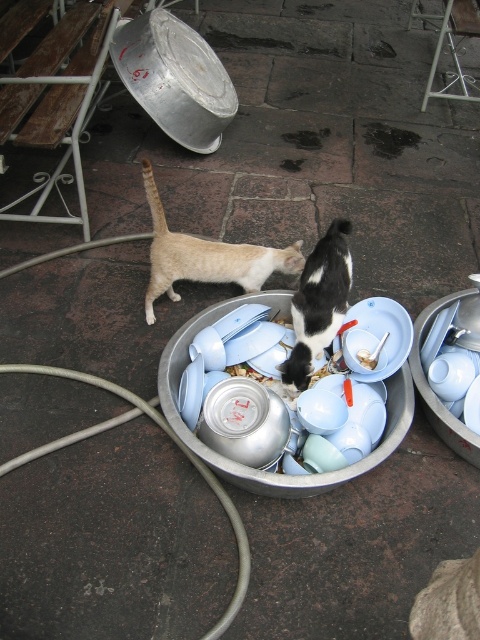
You are a small dog trying to reach the light brown fur at center and the orange plastic spoon at center. Which one is taller?

The light brown fur at center is much taller than the orange plastic spoon at center, so the light brown fur at center is taller.

You are a cat owner trying to locate your two pets. You see a light brown fur at center and an orange plastic spoon at center. Which cat is closer to the spoon?

The light brown fur at center is to the left of the orange plastic spoon at center, so the light brown fur at center is closer to the spoon.